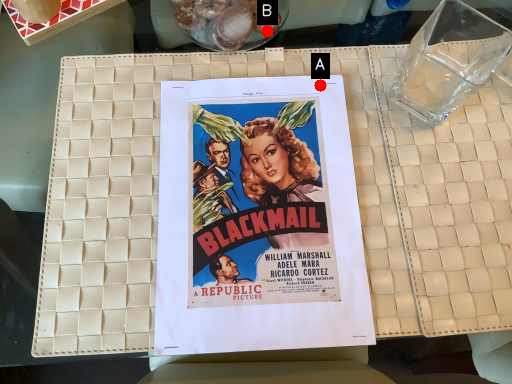
Question: Two points are circled on the image, labeled by A and B beside each circle. Which point is farther to the camera?

Choices:
 (A) A is further
 (B) B is further

Answer: (B)